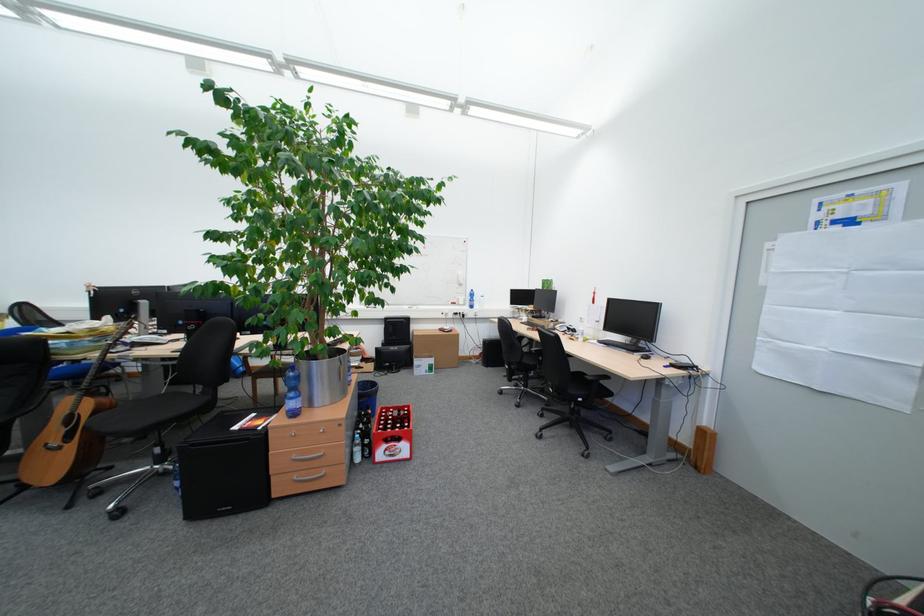
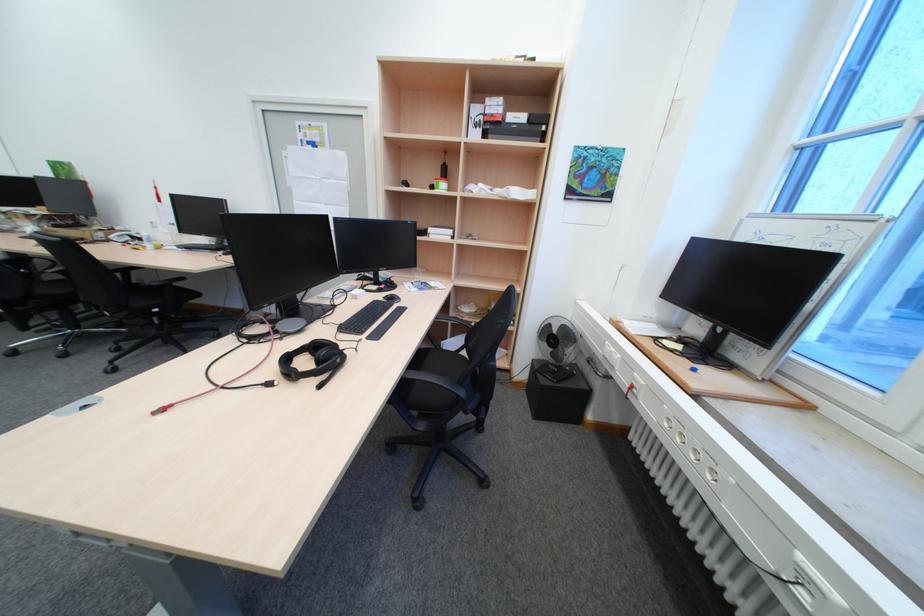
Based on the continuous images, in which direction is the camera rotating?

The camera's rotation is toward right-down.